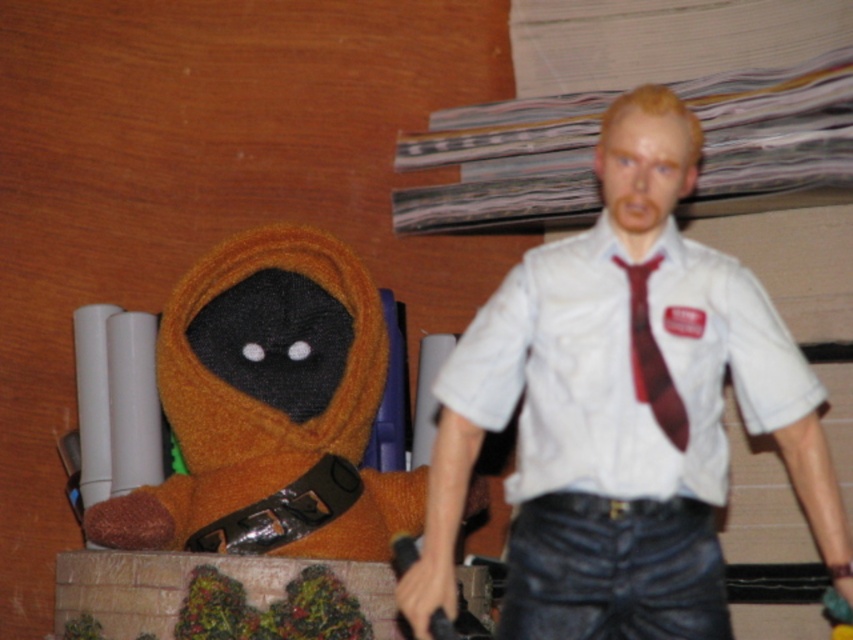
Can you confirm if white matte shirt at upper right is thinner than fuzzy orange stuffed toy at left?

In fact, white matte shirt at upper right might be wider than fuzzy orange stuffed toy at left.

Who is lower down, white matte shirt at upper right or fuzzy orange stuffed toy at left?

fuzzy orange stuffed toy at left is below.

Who is more forward, (675, 138) or (334, 317)?

Point (675, 138) is more forward.

You are a GUI agent. You are given a task and a screenshot of the screen. Output one action in this format:
    pyautogui.click(x=<x>, y=<y>)
    Task: Click on the white matte shirt at upper right
    Image resolution: width=853 pixels, height=640 pixels.
    Given the screenshot: What is the action you would take?
    coord(622,410)

Looking at this image, which of these two, fuzzy orange stuffed toy at left or white matte dress shirt at center, stands taller?

fuzzy orange stuffed toy at left

Between fuzzy orange stuffed toy at left and white matte dress shirt at center, which one is positioned lower?

fuzzy orange stuffed toy at left is below.

Find the location of a particular element. fuzzy orange stuffed toy at left is located at coordinates (270, 410).

Is white matte shirt at upper right thinner than matte red tie at center?

No.

Does white matte shirt at upper right appear under matte red tie at center?

Yes.

Which is behind, point (633, 413) or point (662, 417)?

The point (633, 413) is behind.

Image resolution: width=853 pixels, height=640 pixels. I want to click on white matte shirt at upper right, so click(622, 410).